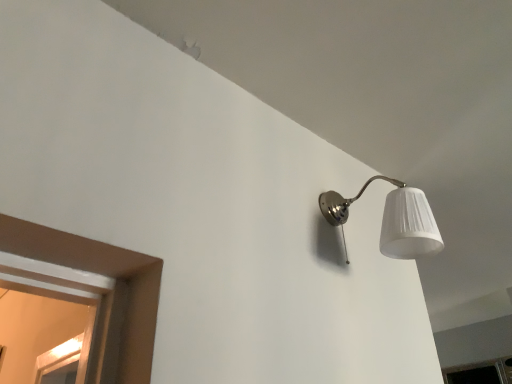
Find the location of `transparent glass window at lower right`. transparent glass window at lower right is located at coordinates (481, 373).

What do you see at coordinates (481, 373) in the screenshot? I see `transparent glass window at lower right` at bounding box center [481, 373].

Describe the element at coordinates (393, 220) in the screenshot. I see `satin nickel lampshade at upper right` at that location.

Identify the location of satin nickel lampshade at upper right. This screenshot has height=384, width=512. (393, 220).

Locate an element on the screen. This screenshot has width=512, height=384. transparent glass window at lower right is located at coordinates (481, 373).

Which is more to the right, transparent glass window at lower right or satin nickel lampshade at upper right?

transparent glass window at lower right.

Who is more distant, transparent glass window at lower right or satin nickel lampshade at upper right?

Positioned behind is transparent glass window at lower right.

Considering the points (461, 382) and (402, 251), which point is in front, point (461, 382) or point (402, 251)?

The point (402, 251) is in front.

From the picture: From the image's perspective, which is below, transparent glass window at lower right or satin nickel lampshade at upper right?

transparent glass window at lower right.

From a real-world perspective, which is physically above, transparent glass window at lower right or satin nickel lampshade at upper right?

satin nickel lampshade at upper right, from a real-world perspective.

Which object is wider, transparent glass window at lower right or satin nickel lampshade at upper right?

With larger width is transparent glass window at lower right.

Is transparent glass window at lower right taller or shorter than satin nickel lampshade at upper right?

In the image, transparent glass window at lower right appears to be shorter than satin nickel lampshade at upper right.

Considering the sizes of objects transparent glass window at lower right and satin nickel lampshade at upper right in the image provided, who is bigger, transparent glass window at lower right or satin nickel lampshade at upper right?

transparent glass window at lower right.

Could satin nickel lampshade at upper right be considered to be inside transparent glass window at lower right?

Definitely not — satin nickel lampshade at upper right is not inside transparent glass window at lower right.

Is transparent glass window at lower right touching satin nickel lampshade at upper right?

There is a gap between transparent glass window at lower right and satin nickel lampshade at upper right.

Is transparent glass window at lower right aimed at satin nickel lampshade at upper right?

Yes, transparent glass window at lower right is oriented towards satin nickel lampshade at upper right.

Identify the location of lamp above the transparent glass window at lower right (from the image's perspective). click(x=393, y=220).

Considering the relative positions of satin nickel lampshade at upper right and transparent glass window at lower right in the image provided, is satin nickel lampshade at upper right to the right of transparent glass window at lower right from the viewer's perspective?

In fact, satin nickel lampshade at upper right is to the left of transparent glass window at lower right.

Relative to transparent glass window at lower right, is satin nickel lampshade at upper right in front or behind?

satin nickel lampshade at upper right is in front of transparent glass window at lower right.

Is point (348, 262) positioned before point (465, 372)?

Yes, point (348, 262) is closer to viewer.

Looking at this image, from the image's perspective, which object appears higher, satin nickel lampshade at upper right or transparent glass window at lower right?

satin nickel lampshade at upper right.

Based on the photo, from a real-world perspective, who is located lower, satin nickel lampshade at upper right or transparent glass window at lower right?

transparent glass window at lower right is physically lower.

From the picture: Does satin nickel lampshade at upper right have a lesser width compared to transparent glass window at lower right?

Indeed, satin nickel lampshade at upper right has a lesser width compared to transparent glass window at lower right.

Considering the relative sizes of satin nickel lampshade at upper right and transparent glass window at lower right in the image provided, is satin nickel lampshade at upper right taller than transparent glass window at lower right?

Indeed, satin nickel lampshade at upper right has a greater height compared to transparent glass window at lower right.

In terms of size, does satin nickel lampshade at upper right appear bigger or smaller than transparent glass window at lower right?

Considering their sizes, satin nickel lampshade at upper right takes up less space than transparent glass window at lower right.

Would you say satin nickel lampshade at upper right contains transparent glass window at lower right?

Definitely not — transparent glass window at lower right is not inside satin nickel lampshade at upper right.

Is satin nickel lampshade at upper right touching transparent glass window at lower right?

satin nickel lampshade at upper right and transparent glass window at lower right are not in contact.

Is satin nickel lampshade at upper right turned away from transparent glass window at lower right?

No, transparent glass window at lower right is not at the back of satin nickel lampshade at upper right.

Can you tell me how much satin nickel lampshade at upper right and transparent glass window at lower right differ in facing direction?

The angular difference between satin nickel lampshade at upper right and transparent glass window at lower right is 90.4 degrees.

Identify the location of lamp that is above the transparent glass window at lower right (from the image's perspective). (393, 220).

Locate an element on the screen. lamp above the transparent glass window at lower right (from a real-world perspective) is located at coordinates (393, 220).

In the image, there is a satin nickel lampshade at upper right. Identify the location of window below it (from a real-world perspective). (481, 373).